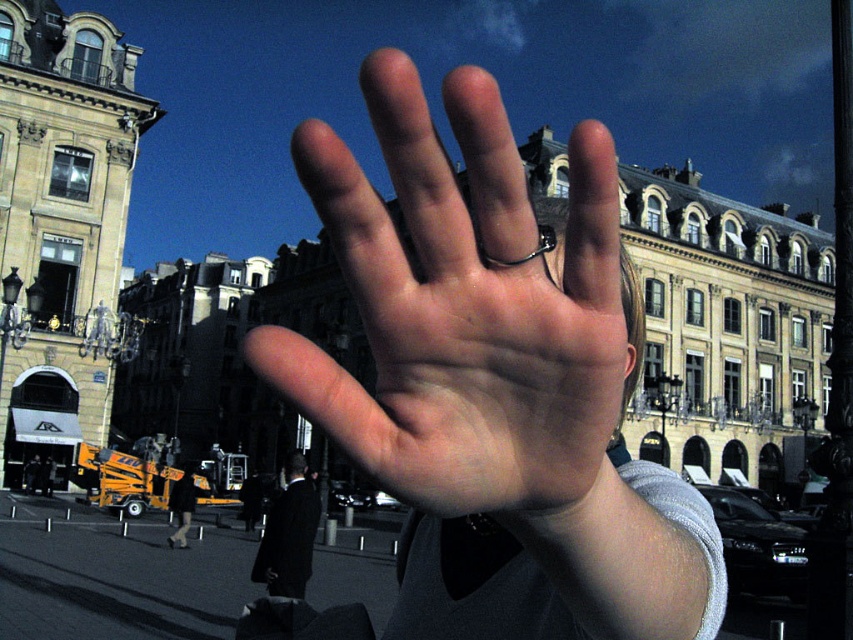
Question: Observing the image, what is the correct spatial positioning of smooth skin hand at center in reference to silver metallic ring at center?

Choices:
 (A) above
 (B) below

Answer: (B)

Question: Is dark suit at center positioned behind silver metallic ring at center?

Choices:
 (A) yes
 (B) no

Answer: (A)

Question: Which object appears farthest from the camera in this image?

Choices:
 (A) smooth skin hand at center
 (B) silver metallic ring at center

Answer: (B)

Question: Which object is the farthest from the smooth skin hand at center?

Choices:
 (A) silver metallic ring at center
 (B) dark suit at center

Answer: (B)

Question: Among these objects, which one is nearest to the camera?

Choices:
 (A) smooth skin hand at center
 (B) dark suit at center

Answer: (A)

Question: From the image, what is the correct spatial relationship of smooth skin hand at center in relation to silver metallic ring at center?

Choices:
 (A) left
 (B) right

Answer: (A)